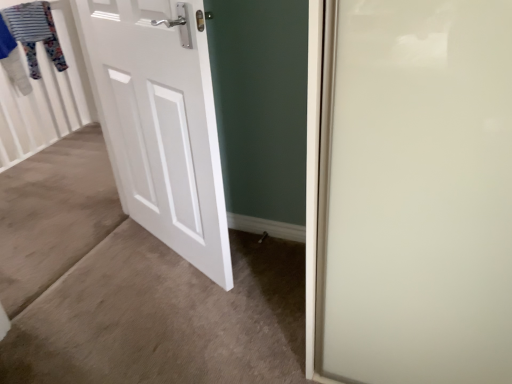
Question: Should I look upward or downward to see white matte door at left?

Choices:
 (A) up
 (B) down

Answer: (A)

Question: From a real-world perspective, is striped fabric clothesline at upper left located higher than white matte door at left?

Choices:
 (A) no
 (B) yes

Answer: (B)

Question: From the image's perspective, is striped fabric clothesline at upper left over white matte door at left?

Choices:
 (A) yes
 (B) no

Answer: (A)

Question: Is striped fabric clothesline at upper left positioned beyond the bounds of white matte door at left?

Choices:
 (A) yes
 (B) no

Answer: (A)

Question: Does striped fabric clothesline at upper left appear on the right side of white matte door at left?

Choices:
 (A) yes
 (B) no

Answer: (B)

Question: From the image's perspective, does striped fabric clothesline at upper left appear lower than white matte door at left?

Choices:
 (A) no
 (B) yes

Answer: (A)

Question: Could white matte door at left be considered to be inside striped fabric clothesline at upper left?

Choices:
 (A) yes
 (B) no

Answer: (B)

Question: Is white matte door at left facing towards striped fabric clothesline at upper left?

Choices:
 (A) no
 (B) yes

Answer: (A)

Question: From the image's perspective, is white matte door at left above striped fabric clothesline at upper left?

Choices:
 (A) no
 (B) yes

Answer: (A)

Question: Can you see white matte door at left touching striped fabric clothesline at upper left?

Choices:
 (A) no
 (B) yes

Answer: (A)

Question: Can you confirm if white matte door at left is smaller than striped fabric clothesline at upper left?

Choices:
 (A) yes
 (B) no

Answer: (B)

Question: From a real-world perspective, is white matte door at left positioned over striped fabric clothesline at upper left based on gravity?

Choices:
 (A) yes
 (B) no

Answer: (B)

Question: From a real-world perspective, is white matte door at left physically below striped fabric clothesline at upper left?

Choices:
 (A) yes
 (B) no

Answer: (A)

Question: Considering their positions, is white matte door at left located in front of or behind striped fabric clothesline at upper left?

Choices:
 (A) behind
 (B) front

Answer: (B)